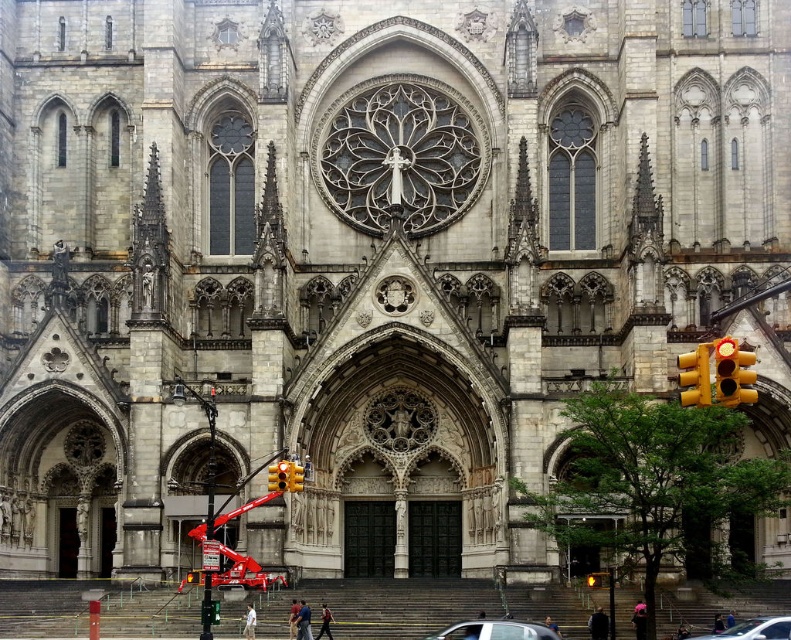
You are standing in front of the cathedral and see a silver metallic car at center and a metallic silver car at lower right. Which car is closer to the main entrance?

The silver metallic car at center is closer to the main entrance because it is positioned on the left side of the metallic silver car at lower right, which places it nearer to the entrance area.